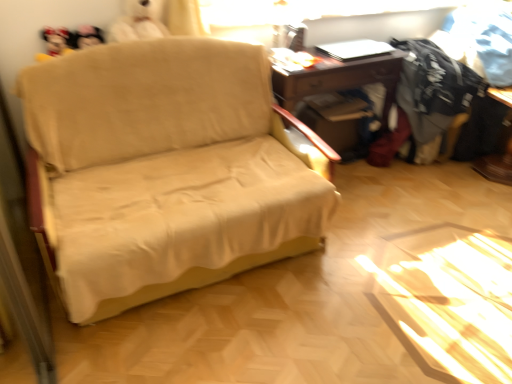
Question: Do you think black printed fabric at upper right, arranged as the 2th clothing when viewed from the left, is within wooden desk at center, or outside of it?

Choices:
 (A) inside
 (B) outside

Answer: (B)

Question: Is point coord(489,72) positioned closer to the camera than point coord(290,89)?

Choices:
 (A) closer
 (B) farther

Answer: (B)

Question: Estimate the real-world distances between objects in this image. Which object is closer to the beige fabric couch at center?

Choices:
 (A) dark gray cotton shirt at right, arranged as the 1th clothing when viewed from the left
 (B) black printed fabric at upper right, arranged as the 2th clothing when viewed from the left
 (C) wooden desk at center

Answer: (C)

Question: Estimate the real-world distances between objects in this image. Which object is farther from the dark gray cotton shirt at right, arranged as the 1th clothing when viewed from the left?

Choices:
 (A) beige fabric couch at center
 (B) black printed fabric at upper right, arranged as the 2th clothing when viewed from the left
 (C) wooden desk at center

Answer: (A)